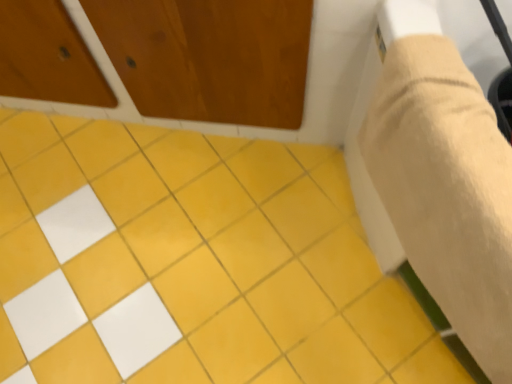
Question: Considering the relative sizes of beige fabric plaster bandage at right and yellow matte tile at center in the image provided, is beige fabric plaster bandage at right wider than yellow matte tile at center?

Choices:
 (A) yes
 (B) no

Answer: (B)

Question: Is beige fabric plaster bandage at right turned away from yellow matte tile at center?

Choices:
 (A) no
 (B) yes

Answer: (A)

Question: Considering the relative positions of beige fabric plaster bandage at right and yellow matte tile at center in the image provided, is beige fabric plaster bandage at right to the left of yellow matte tile at center from the viewer's perspective?

Choices:
 (A) no
 (B) yes

Answer: (A)

Question: Could you tell me if beige fabric plaster bandage at right is facing yellow matte tile at center?

Choices:
 (A) yes
 (B) no

Answer: (B)

Question: Can you confirm if beige fabric plaster bandage at right is bigger than yellow matte tile at center?

Choices:
 (A) no
 (B) yes

Answer: (B)

Question: From a real-world perspective, does beige fabric plaster bandage at right sit lower than yellow matte tile at center?

Choices:
 (A) yes
 (B) no

Answer: (B)

Question: From a real-world perspective, is yellow matte tile at center located higher than beige fabric plaster bandage at right?

Choices:
 (A) yes
 (B) no

Answer: (B)

Question: Would you say yellow matte tile at center is outside beige fabric plaster bandage at right?

Choices:
 (A) yes
 (B) no

Answer: (A)

Question: Can you confirm if yellow matte tile at center is smaller than beige fabric plaster bandage at right?

Choices:
 (A) no
 (B) yes

Answer: (B)

Question: Is yellow matte tile at center touching beige fabric plaster bandage at right?

Choices:
 (A) no
 (B) yes

Answer: (A)

Question: From a real-world perspective, is yellow matte tile at center below beige fabric plaster bandage at right?

Choices:
 (A) no
 (B) yes

Answer: (B)

Question: Is yellow matte tile at center turned away from beige fabric plaster bandage at right?

Choices:
 (A) yes
 (B) no

Answer: (B)

Question: Based on their sizes in the image, would you say yellow matte tile at center is bigger or smaller than beige fabric plaster bandage at right?

Choices:
 (A) big
 (B) small

Answer: (B)